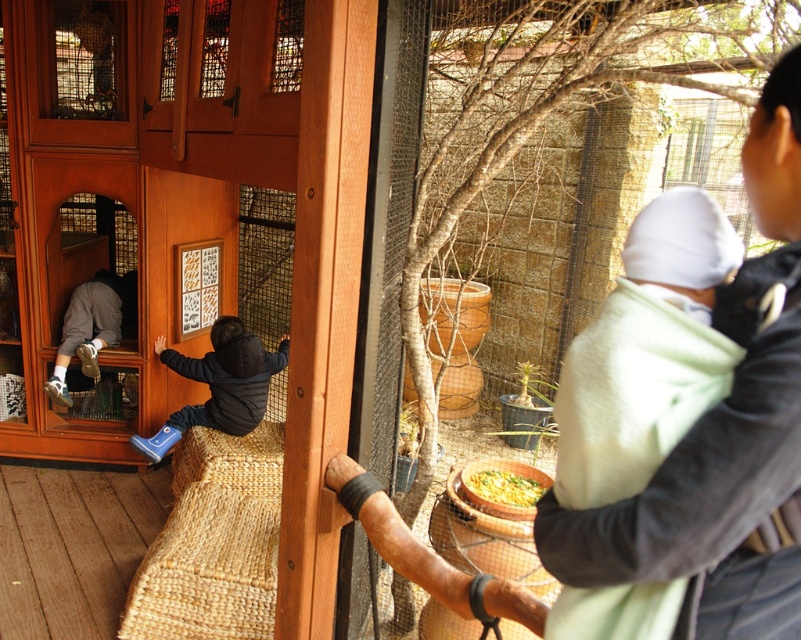
Is matte gray hoodie at left to the left of yellow matte bowl at lower center from the viewer's perspective?

Indeed, matte gray hoodie at left is positioned on the left side of yellow matte bowl at lower center.

Can you confirm if matte gray hoodie at left is wider than yellow matte bowl at lower center?

Correct, the width of matte gray hoodie at left exceeds that of yellow matte bowl at lower center.

Does point (83, 337) come closer to viewer compared to point (514, 499)?

No, it is not.

You are a GUI agent. You are given a task and a screenshot of the screen. Output one action in this format:
    pyautogui.click(x=<x>, y=<y>)
    Task: Click on the matte gray hoodie at left
    
    Given the screenshot: What is the action you would take?
    coord(91,326)

What do you see at coordinates (87, 273) in the screenshot? The width and height of the screenshot is (801, 640). I see `matte wood screen door at left` at bounding box center [87, 273].

In the scene shown: Does matte wood screen door at left have a smaller size compared to yellow matte bowl at lower center?

Incorrect, matte wood screen door at left is not smaller in size than yellow matte bowl at lower center.

The width and height of the screenshot is (801, 640). What do you see at coordinates (87, 273) in the screenshot? I see `matte wood screen door at left` at bounding box center [87, 273].

Find the location of `matte wood screen door at left`. matte wood screen door at left is located at coordinates (87, 273).

Consider the image. Which is above, matte wood screen door at left or blue rubber boots at left?

matte wood screen door at left

Is the position of matte wood screen door at left less distant than that of blue rubber boots at left?

No, matte wood screen door at left is further to the viewer.

Is point (111, 220) closer to camera compared to point (256, 420)?

No, it is not.

Image resolution: width=801 pixels, height=640 pixels. I want to click on matte wood screen door at left, so click(87, 273).